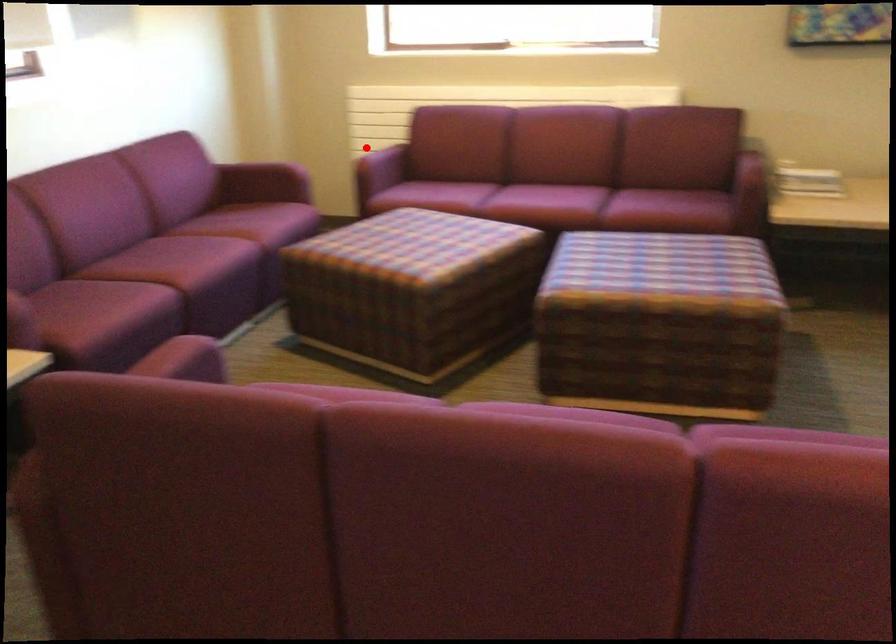
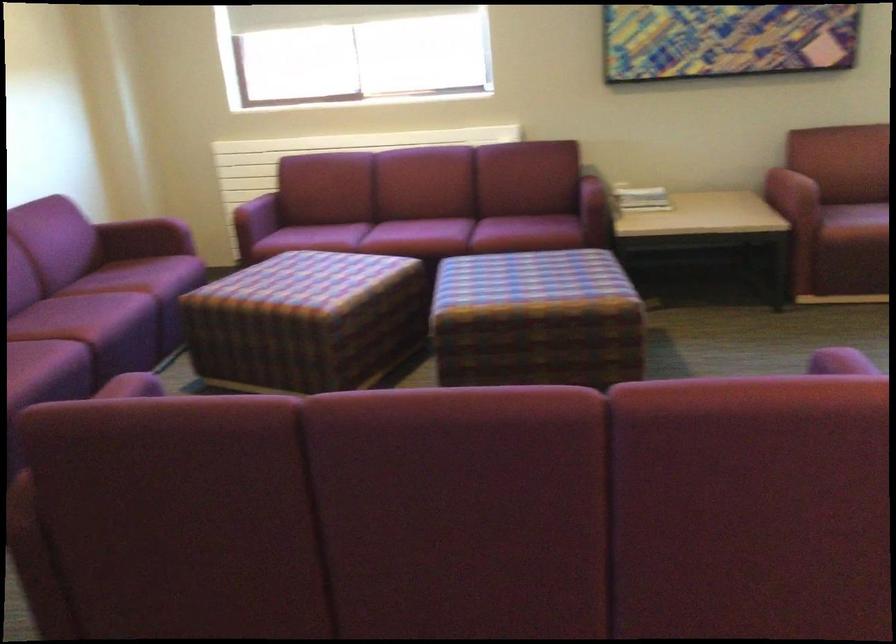
The point at the highlighted location is marked in the first image. Where is the corresponding point in the second image?

(242, 198)